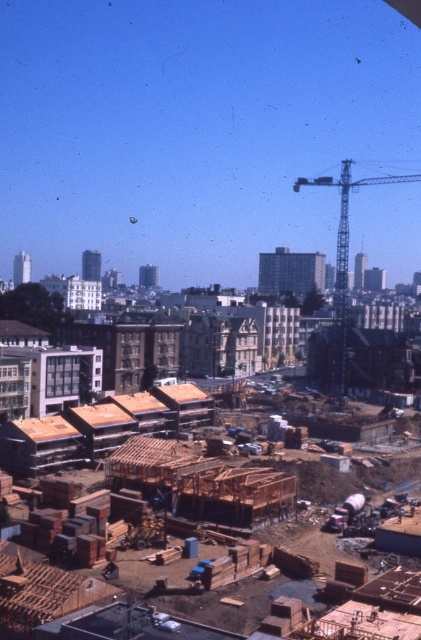
Question: Is wooden frame at center thinner than metallic gray crane at upper right?

Choices:
 (A) no
 (B) yes

Answer: (B)

Question: Which object is closer to the camera taking this photo?

Choices:
 (A) metallic gray crane at upper right
 (B) wooden frame at center

Answer: (B)

Question: Which point is closer to the camera taking this photo?

Choices:
 (A) (341, 340)
 (B) (0, 456)

Answer: (B)

Question: In this image, where is wooden frame at center located relative to metallic gray crane at upper right?

Choices:
 (A) above
 (B) below

Answer: (B)

Question: Among these objects, which one is nearest to the camera?

Choices:
 (A) wooden frame at center
 (B) metallic gray crane at upper right

Answer: (A)

Question: Is wooden frame at center bigger than metallic gray crane at upper right?

Choices:
 (A) yes
 (B) no

Answer: (B)